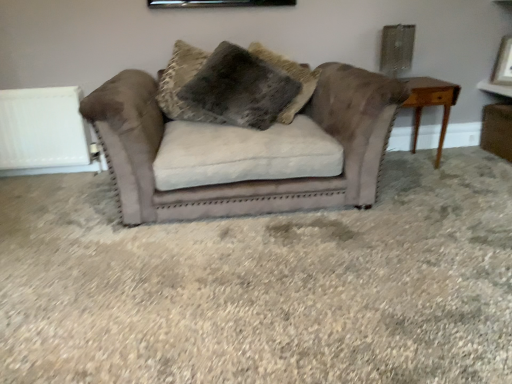
Question: Does fuzzy brown pillow at center have a larger size compared to suede couch at center?

Choices:
 (A) yes
 (B) no

Answer: (B)

Question: Is fuzzy brown pillow at center positioned behind suede couch at center?

Choices:
 (A) no
 (B) yes

Answer: (B)

Question: Does fuzzy brown pillow at center have a smaller size compared to suede couch at center?

Choices:
 (A) no
 (B) yes

Answer: (B)

Question: Is fuzzy brown pillow at center outside suede couch at center?

Choices:
 (A) no
 (B) yes

Answer: (A)

Question: Can you confirm if fuzzy brown pillow at center is shorter than suede couch at center?

Choices:
 (A) no
 (B) yes

Answer: (A)

Question: Is matte white picture frame at upper right inside the boundaries of white matte radiator at left, or outside?

Choices:
 (A) inside
 (B) outside

Answer: (B)

Question: Looking at their shapes, would you say matte white picture frame at upper right is wider or thinner than white matte radiator at left?

Choices:
 (A) thin
 (B) wide

Answer: (A)

Question: Looking at the image, does matte white picture frame at upper right seem bigger or smaller compared to white matte radiator at left?

Choices:
 (A) small
 (B) big

Answer: (A)

Question: Does point (504, 84) appear closer or farther from the camera than point (1, 97)?

Choices:
 (A) closer
 (B) farther

Answer: (B)

Question: Considering the positions of light brown wooden table at right and white matte radiator at left in the image, is light brown wooden table at right wider or thinner than white matte radiator at left?

Choices:
 (A) thin
 (B) wide

Answer: (B)

Question: Does point (442, 87) appear closer or farther from the camera than point (59, 112)?

Choices:
 (A) closer
 (B) farther

Answer: (A)

Question: Is light brown wooden table at right bigger or smaller than white matte radiator at left?

Choices:
 (A) big
 (B) small

Answer: (A)

Question: From the image's perspective, is light brown wooden table at right located above or below white matte radiator at left?

Choices:
 (A) above
 (B) below

Answer: (A)

Question: From a real-world perspective, is white matte radiator at left physically located above or below fuzzy brown pillow at center?

Choices:
 (A) below
 (B) above

Answer: (A)

Question: Considering their positions, is white matte radiator at left located in front of or behind fuzzy brown pillow at center?

Choices:
 (A) behind
 (B) front

Answer: (A)